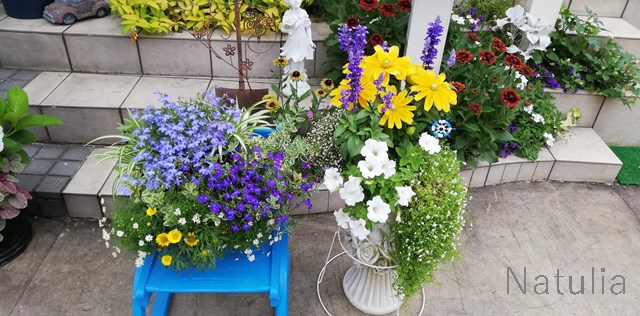
What are the coordinates of `blue step stool` in the screenshot? It's located at (252, 274).